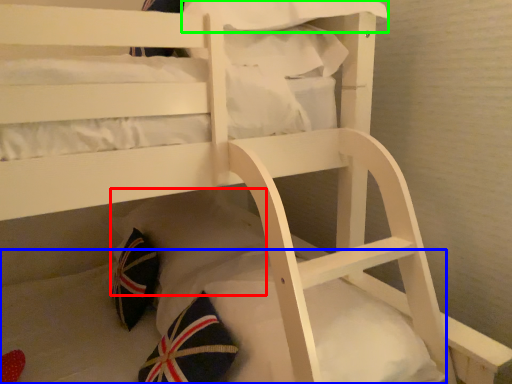
Question: Which object is the farthest from pillow (highlighted by a red box)? Choose among these: mattress (highlighted by a blue box) or pillow (highlighted by a green box).

Choices:
 (A) mattress
 (B) pillow

Answer: (B)